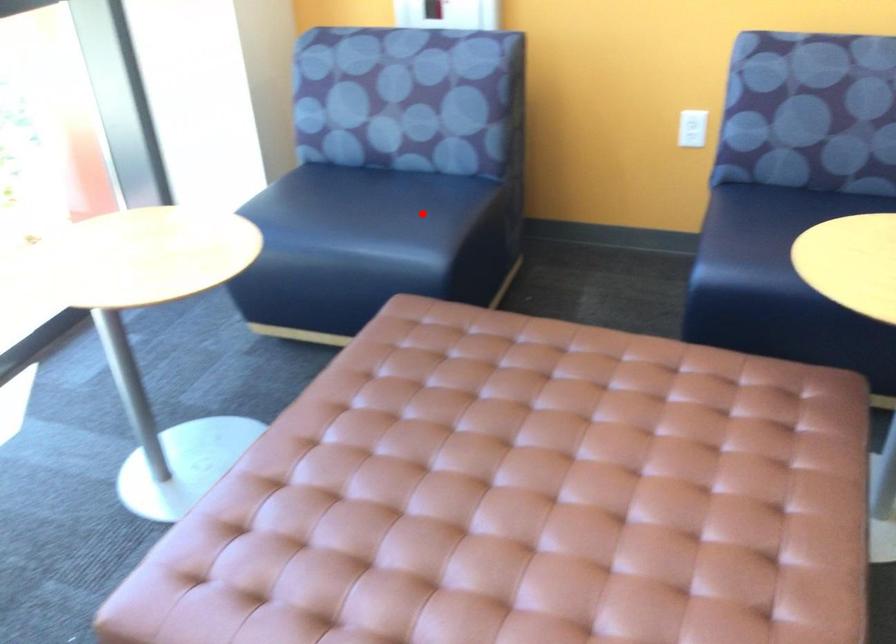
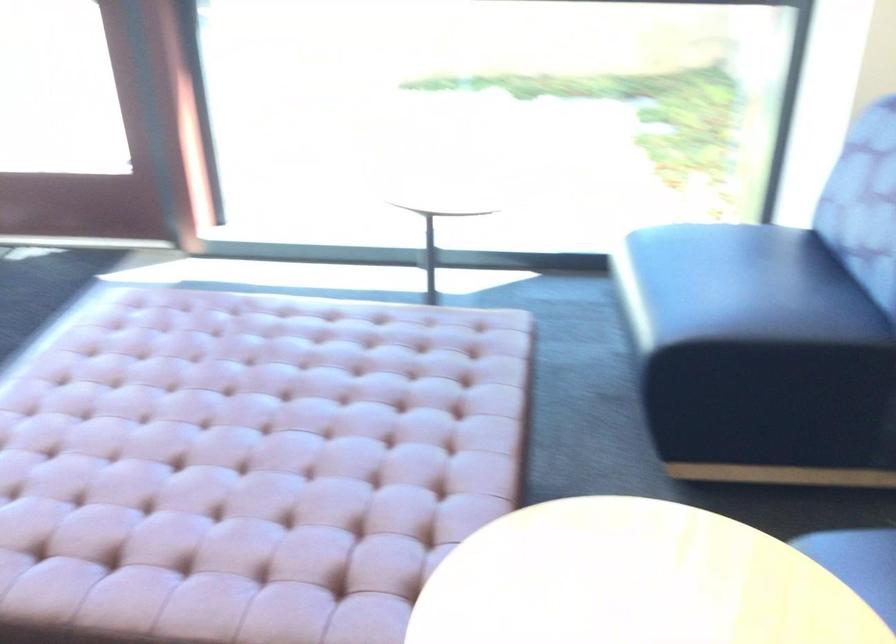
Question: A red point is marked in image1. In image2, is the corresponding 3D point closer to the camera or farther? Reply with the corresponding letter.

Choices:
 (A) The corresponding 3D point is closer.
 (B) The corresponding 3D point is farther.

Answer: (A)